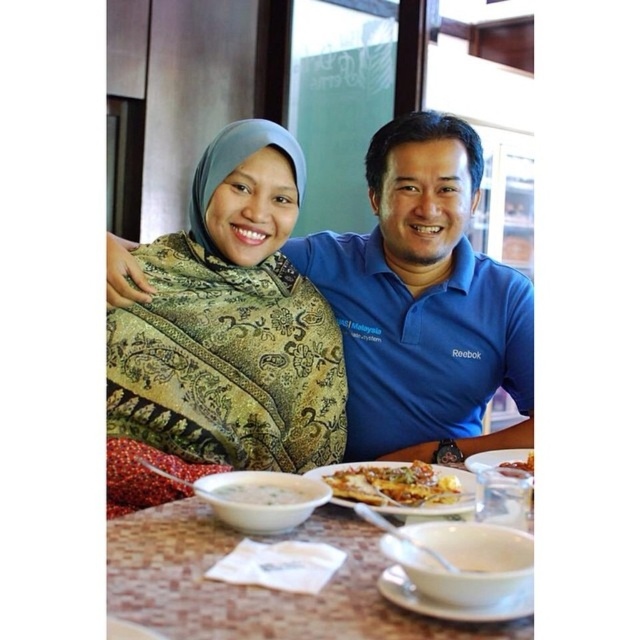
You are a waiter in a restaurant and need to place a new dish on the table. The table has the green batik scarf at center and the white ceramic plate at lower center. Where should you place the new dish so it doesn t get covered by the scarf?

The green batik scarf at center is above the white ceramic plate at lower center, so you should place the new dish below the green batik scarf at center to avoid it being covered.